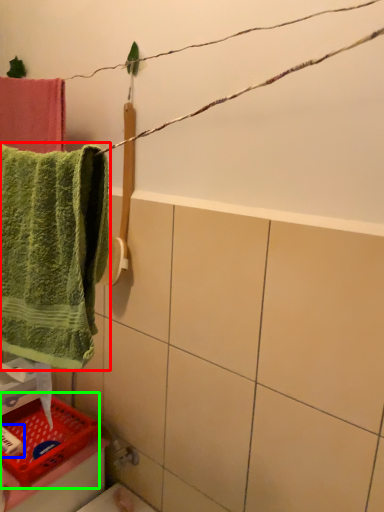
Question: Estimate the real-world distances between objects in this image. Which object is farther from towel (highlighted by a red box), toiletry (highlighted by a blue box) or basket (highlighted by a green box)?

Choices:
 (A) toiletry
 (B) basket

Answer: (A)